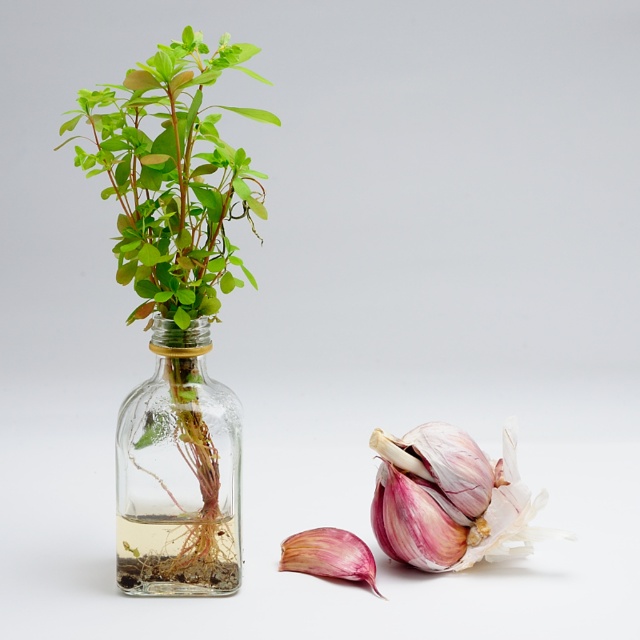
Question: Based on their relative distances, which object is nearer to the green matte plant at center?

Choices:
 (A) transparent glass vase at left
 (B) pinkish-purple papery onion at lower right

Answer: (A)

Question: Is pinkish-purple papery onion at lower right above pink matte garlic at lower right?

Choices:
 (A) no
 (B) yes

Answer: (B)

Question: Considering the real-world distances, which object is closest to the pink matte garlic at lower right?

Choices:
 (A) pinkish-purple papery onion at lower right
 (B) green matte plant at center
 (C) transparent glass vase at left

Answer: (A)

Question: Which object appears farthest from the camera in this image?

Choices:
 (A) green matte plant at center
 (B) transparent glass vase at left
 (C) pinkish-purple papery onion at lower right

Answer: (C)

Question: Is transparent glass vase at left to the left of pink matte garlic at lower right from the viewer's perspective?

Choices:
 (A) yes
 (B) no

Answer: (A)

Question: Is green matte plant at center thinner than pinkish-purple papery onion at lower right?

Choices:
 (A) yes
 (B) no

Answer: (B)